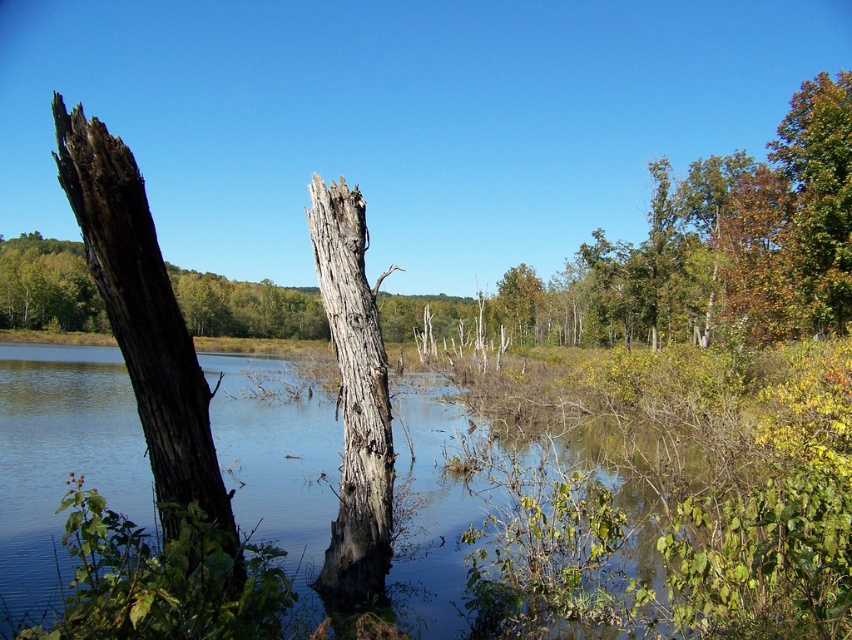
Question: Which point appears closest to the camera in this image?

Choices:
 (A) (698, 486)
 (B) (150, 275)
 (C) (376, 371)

Answer: (B)

Question: Which object is positioned closest to the clear water at center?

Choices:
 (A) gray rough bark tree trunk at center
 (B) dark brown rough bark tree trunk at left

Answer: (A)

Question: Is clear water at center bigger than dark brown rough bark tree trunk at left?

Choices:
 (A) no
 (B) yes

Answer: (B)

Question: Estimate the real-world distances between objects in this image. Which object is closer to the clear water at center?

Choices:
 (A) gray rough bark tree trunk at center
 (B) dark brown rough bark tree trunk at left

Answer: (A)

Question: Can you confirm if clear water at center is wider than gray rough bark tree trunk at center?

Choices:
 (A) no
 (B) yes

Answer: (B)

Question: Does dark brown rough bark tree trunk at left have a lesser width compared to gray rough bark tree trunk at center?

Choices:
 (A) no
 (B) yes

Answer: (A)